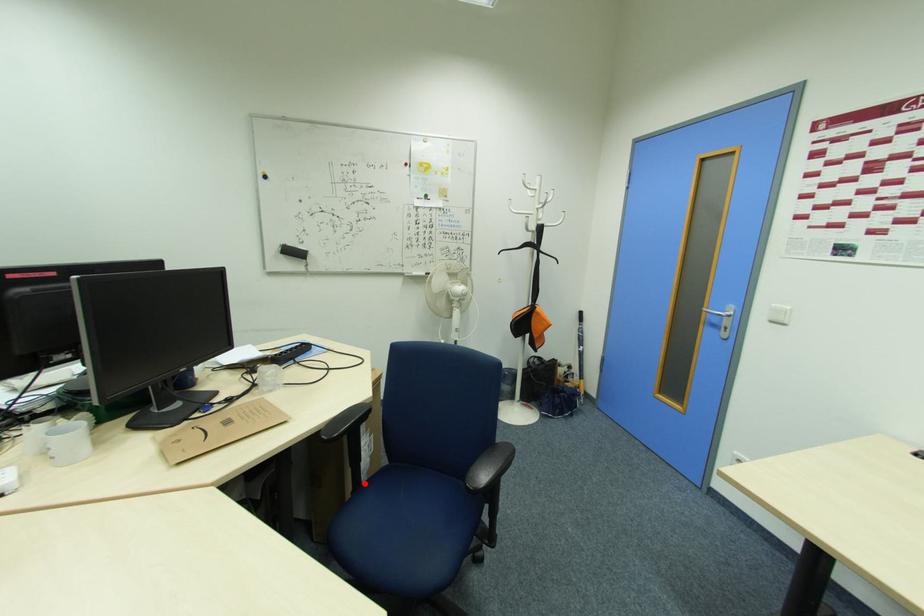
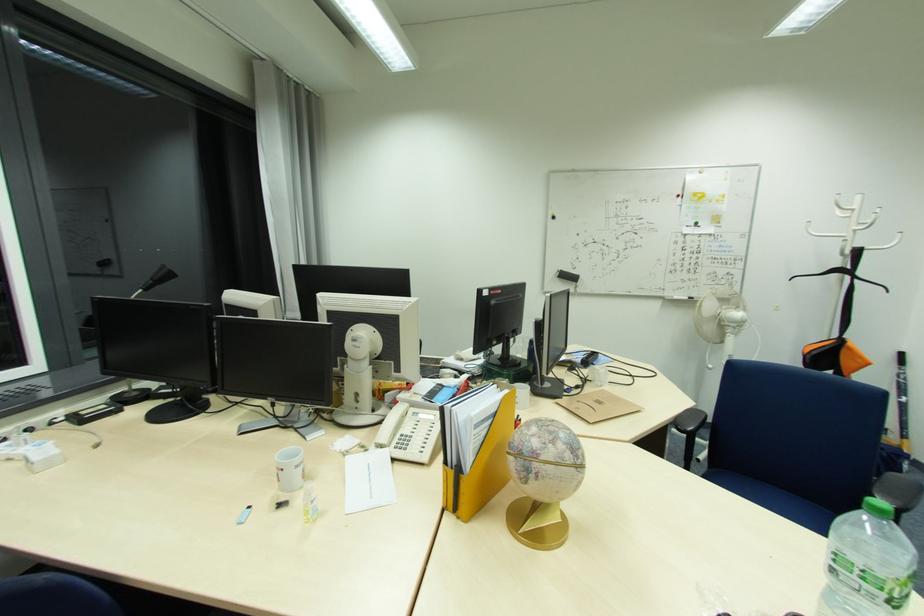
Question: I am providing you with two images of the same scene from different viewpoints. A red point is marked on the first image. Can you still see the location of the red point in image 2?

Choices:
 (A) Yes
 (B) No

Answer: (B)